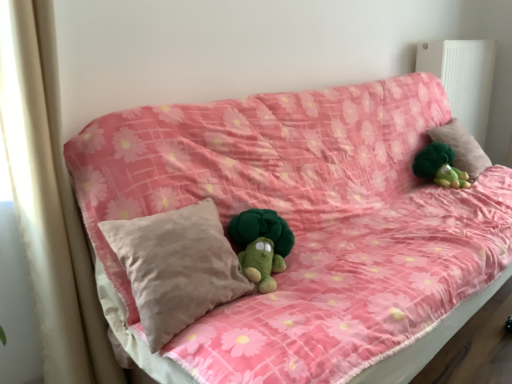
Question: From the image's perspective, is beige soft pillow at center, placed as the second pillow when sorted from back to front, on green plush toy at upper right?

Choices:
 (A) yes
 (B) no

Answer: (B)

Question: Is beige soft pillow at center, which is counted as the second pillow, starting from the right, aimed at green plush toy at upper right?

Choices:
 (A) yes
 (B) no

Answer: (B)

Question: Is beige soft pillow at center, which is counted as the first pillow, starting from the left, closer to camera compared to green plush toy at upper right?

Choices:
 (A) yes
 (B) no

Answer: (A)

Question: Does beige soft pillow at center, which ranks as the 1th pillow in bottom-to-top order, lie behind green plush toy at upper right?

Choices:
 (A) yes
 (B) no

Answer: (B)

Question: Can you confirm if beige soft pillow at center, arranged as the second pillow when viewed from the top, is wider than green plush toy at upper right?

Choices:
 (A) no
 (B) yes

Answer: (B)

Question: Looking at the image, does beige soft pillow at center, which is counted as the first pillow, starting from the front, seem bigger or smaller compared to beige fabric curtain at left?

Choices:
 (A) big
 (B) small

Answer: (B)

Question: Does point (150, 231) appear closer or farther from the camera than point (42, 243)?

Choices:
 (A) farther
 (B) closer

Answer: (B)

Question: Which is correct: beige soft pillow at center, which is counted as the first pillow, starting from the front, is inside beige fabric curtain at left, or outside of it?

Choices:
 (A) inside
 (B) outside

Answer: (B)

Question: From a real-world perspective, relative to beige fabric curtain at left, is beige soft pillow at center, which is counted as the second pillow, starting from the right, vertically above or below?

Choices:
 (A) above
 (B) below

Answer: (B)

Question: Considering their positions, is beige fabric curtain at left located in front of or behind pink fabric couch at center?

Choices:
 (A) front
 (B) behind

Answer: (B)

Question: From a real-world perspective, is beige fabric curtain at left above or below pink fabric couch at center?

Choices:
 (A) above
 (B) below

Answer: (A)

Question: Is beige fabric curtain at left spatially inside pink fabric couch at center, or outside of it?

Choices:
 (A) inside
 (B) outside

Answer: (B)

Question: Looking at the image, does beige fabric curtain at left seem bigger or smaller compared to pink fabric couch at center?

Choices:
 (A) small
 (B) big

Answer: (A)

Question: Is white plastic radiator at upper right taller or shorter than beige soft pillow at center, arranged as the second pillow when viewed from the top?

Choices:
 (A) tall
 (B) short

Answer: (A)

Question: Which is correct: white plastic radiator at upper right is inside beige soft pillow at center, placed as the second pillow when sorted from back to front, or outside of it?

Choices:
 (A) inside
 (B) outside

Answer: (B)